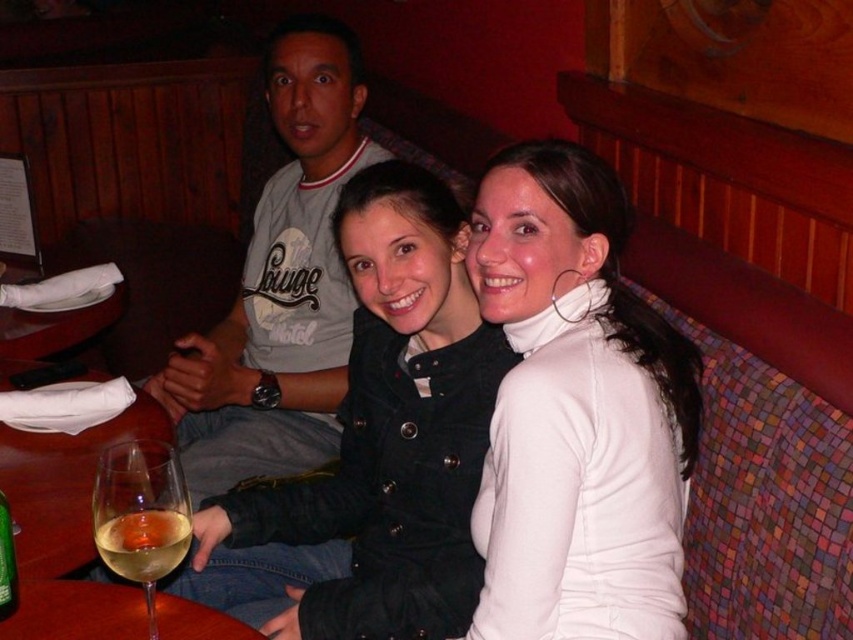
You are a photographer trying to capture the perfect shot of the two people on the right. You notice two points of interest marked at coordinates point (138, 449) and point (140, 570). Which point is closer to the camera?

Point (138, 449) is closer to the camera than point (140, 570).

You are a waiter in a restaurant. You need to place a small note between the clear glass wine glass at lower left and the white translucent glass at lower left. Can you fit it there?

The clear glass wine glass at lower left and white translucent glass at lower left are 0.87 inches apart. Since the note is small, it might fit if the space is sufficient, but the exact size of the note isn uncertainty.